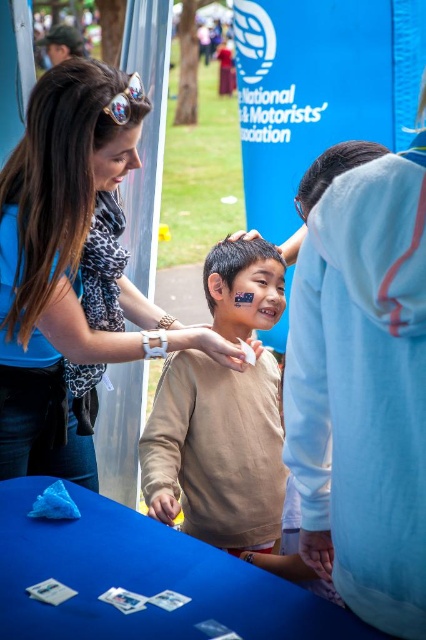
Based on the photo, does blue fabric table at lower center appear on the left side of brown matte hair at center?

Indeed, blue fabric table at lower center is positioned on the left side of brown matte hair at center.

Can you confirm if blue fabric table at lower center is taller than brown matte hair at center?

In fact, blue fabric table at lower center may be shorter than brown matte hair at center.

Between point (173, 586) and point (218, 257), which one is positioned behind?

Point (218, 257)

This screenshot has width=426, height=640. In order to click on blue fabric table at lower center in this screenshot , I will do `click(141, 579)`.

Can you confirm if black smooth hair at upper center is positioned to the right of brown matte hair at center?

Correct, you'll find black smooth hair at upper center to the right of brown matte hair at center.

Does point (356, 141) lie in front of point (227, 244)?

Yes, point (356, 141) is closer to viewer.

Image resolution: width=426 pixels, height=640 pixels. I want to click on black smooth hair at upper center, so click(333, 170).

Which is below, black smooth hair at upper center or smooth blue hand at center?

smooth blue hand at center

Between black smooth hair at upper center and smooth blue hand at center, which one has less height?

smooth blue hand at center is shorter.

The height and width of the screenshot is (640, 426). I want to click on black smooth hair at upper center, so click(333, 170).

Where is `black smooth hair at upper center`? black smooth hair at upper center is located at coordinates (333, 170).